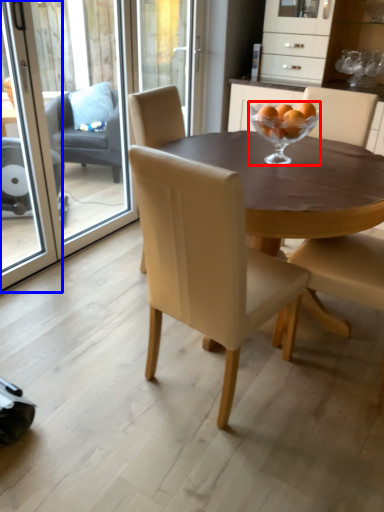
Question: Among these objects, which one is farthest to the camera, martini glass (highlighted by a red box) or screen door (highlighted by a blue box)?

Choices:
 (A) martini glass
 (B) screen door

Answer: (A)